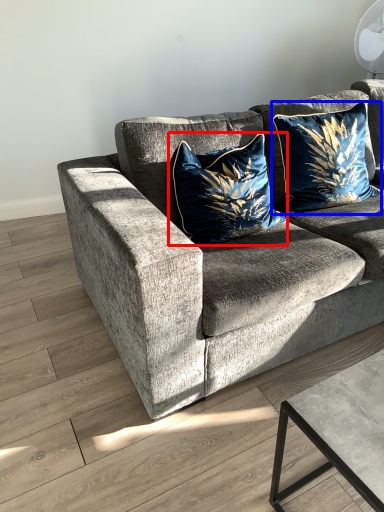
Question: Which object appears farthest to the camera in this image, pillow (highlighted by a red box) or pillow (highlighted by a blue box)?

Choices:
 (A) pillow
 (B) pillow

Answer: (B)